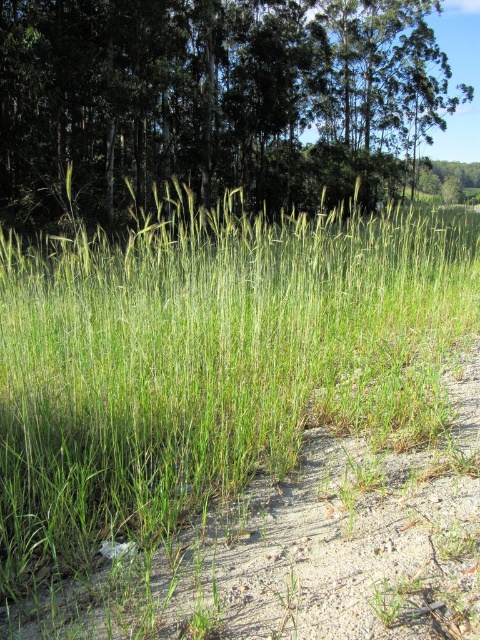
Which is below, green grassy at center or green leafy tree at upper center?

green grassy at center is below.

Consider the image. Can you confirm if green grassy at center is bigger than green leafy tree at upper center?

Incorrect, green grassy at center is not larger than green leafy tree at upper center.

Who is more distant from viewer, [80,333] or [336,154]?

Positioned behind is point [336,154].

Where is `green grassy at center`? This screenshot has width=480, height=640. green grassy at center is located at coordinates (210, 364).